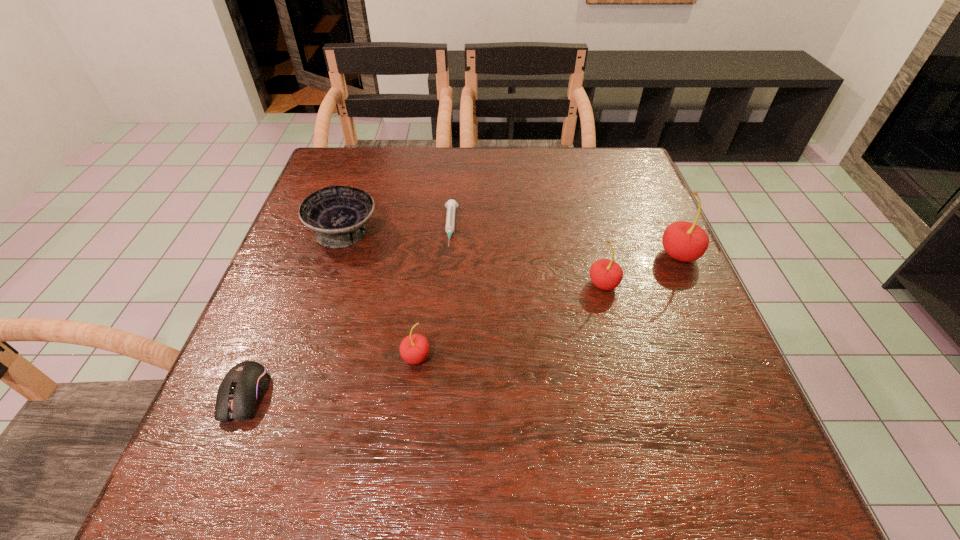
Where is `free space located on the front of the shortest cherry`? The height and width of the screenshot is (540, 960). free space located on the front of the shortest cherry is located at coordinates (411, 400).

Locate an element on the screen. The height and width of the screenshot is (540, 960). free space located 0.090m on the right of the fifth object from left to right is located at coordinates (661, 284).

Identify the location of vacant space located 0.350m on the front of the farthest cherry. The height and width of the screenshot is (540, 960). (755, 419).

Image resolution: width=960 pixels, height=540 pixels. In order to click on vacant area located 0.170m at the needle end of the syringe in this screenshot , I will do `click(444, 307)`.

The height and width of the screenshot is (540, 960). In order to click on free space located 0.120m on the back of the bowl in this screenshot , I will do point(360,184).

Find the location of a particular element. This screenshot has width=960, height=540. free location located 0.270m on the back of the fifth tallest object is located at coordinates (299, 264).

Find the location of `object that is at the near edge`. object that is at the near edge is located at coordinates (243, 386).

Image resolution: width=960 pixels, height=540 pixels. Find the location of `bowl at the left edge`. bowl at the left edge is located at coordinates (337, 213).

Image resolution: width=960 pixels, height=540 pixels. I want to click on computer mouse located at the left edge, so click(243, 386).

Where is `object at the near left corner`? object at the near left corner is located at coordinates (243, 386).